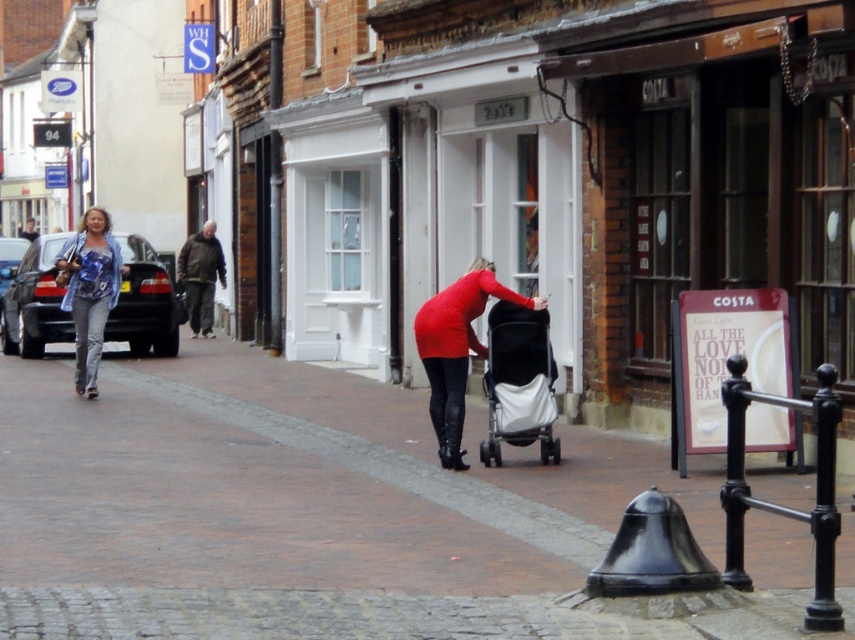
You are standing at the camera position and want to throw a ball to the matte blue blouse at left. If the maximum distance you can throw is 20 meters, will you be able to reach them?

The distance between the matte blue blouse at left and the camera is 19.50 meters. Since your maximum throw distance is 20 meters, you can successfully reach them.

You are standing at the point marked by the coordinates point (323, 513). Describe what is directly beneath your feet at this location.

The point (323, 513) corresponds to the brown cobblestone pavement at center, so you are standing on the brown cobblestone pavement at center.

You are a pedestrian standing at the center of the street. You see a matte red shirt at center and a brown leather jacket at left. Which person is nearer to you?

The matte red shirt at center is closer to the viewer than the brown leather jacket at left, so the person wearing the matte red shirt at center is nearer to you.